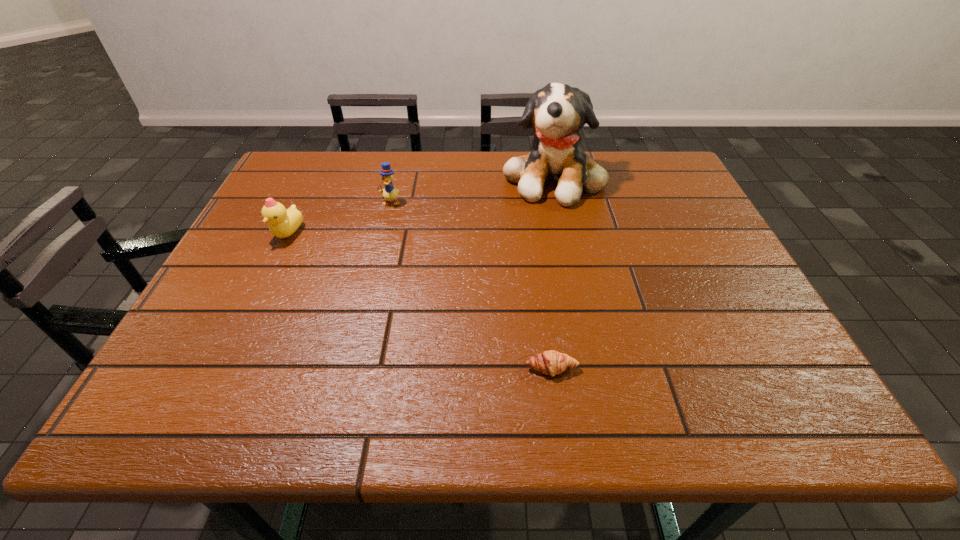
Where is `unoccupied position between the right duckling and the pastry`? unoccupied position between the right duckling and the pastry is located at coordinates (470, 285).

Locate an element on the screen. unoccupied area between the left duckling and the farther duckling is located at coordinates (340, 218).

Find the location of a particular element. This screenshot has width=960, height=540. vacant region between the second nearest object and the right duckling is located at coordinates (340, 218).

What are the coordinates of `vacant space that is in between the second nearest object and the pastry` in the screenshot? It's located at (420, 301).

This screenshot has height=540, width=960. I want to click on free space between the puppy and the second nearest object, so click(x=420, y=205).

Where is `free space between the second object from left to right and the nearest object`? This screenshot has height=540, width=960. free space between the second object from left to right and the nearest object is located at coordinates (470, 285).

Find the location of a particular element. vacant region between the tallest object and the left duckling is located at coordinates (420, 205).

Where is `free point between the tallest object and the right duckling`? Image resolution: width=960 pixels, height=540 pixels. free point between the tallest object and the right duckling is located at coordinates tap(472, 190).

Locate an element on the screen. The image size is (960, 540). vacant space in between the tallest object and the farther duckling is located at coordinates (472, 190).

Locate which object is the third closest to the nearest object. Please provide its 2D coordinates. Your answer should be formatted as a tuple, i.e. [(x, y)], where the tuple contains the x and y coordinates of a point satisfying the conditions above.

[(283, 222)]